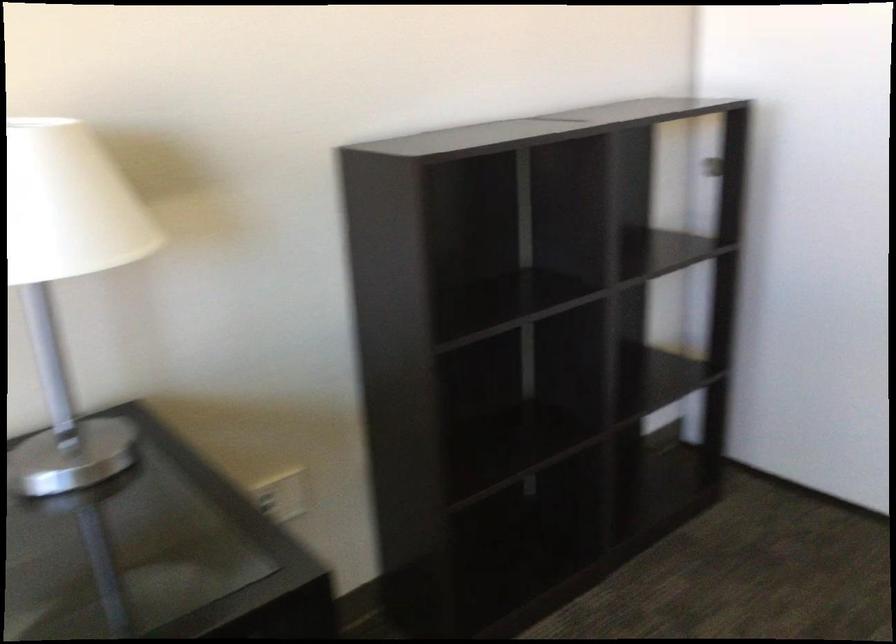
Where would you plugg the white wall outlet? Please return your answer as a coordinate pair (x, y).

(281, 494)